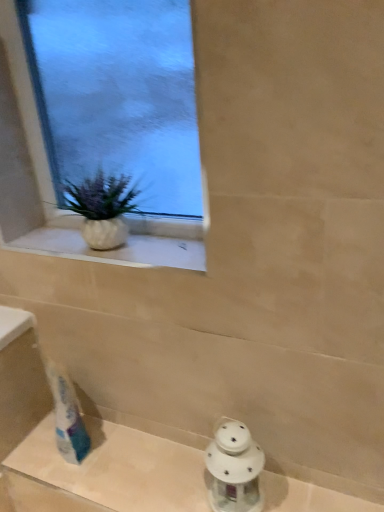
Identify the location of vacant region above white glass lantern at lower center (from a real-world perspective). This screenshot has height=512, width=384. (164, 472).